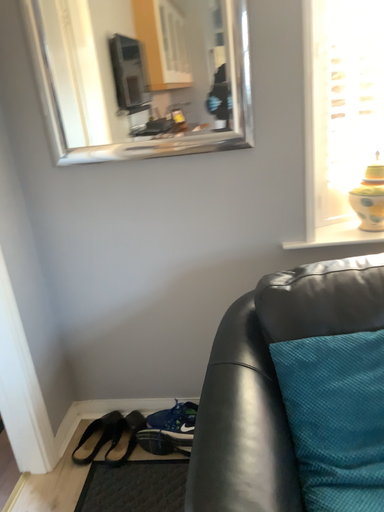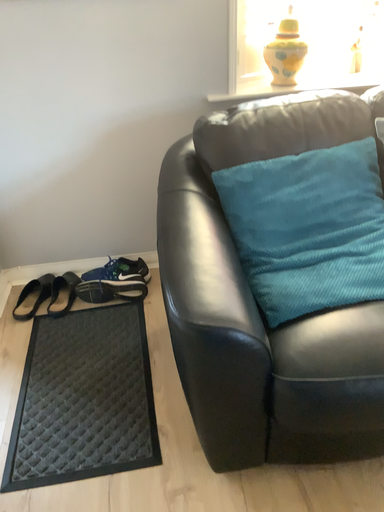
Question: How did the camera likely rotate when shooting the video?

Choices:
 (A) rotated downward
 (B) rotated upward

Answer: (A)